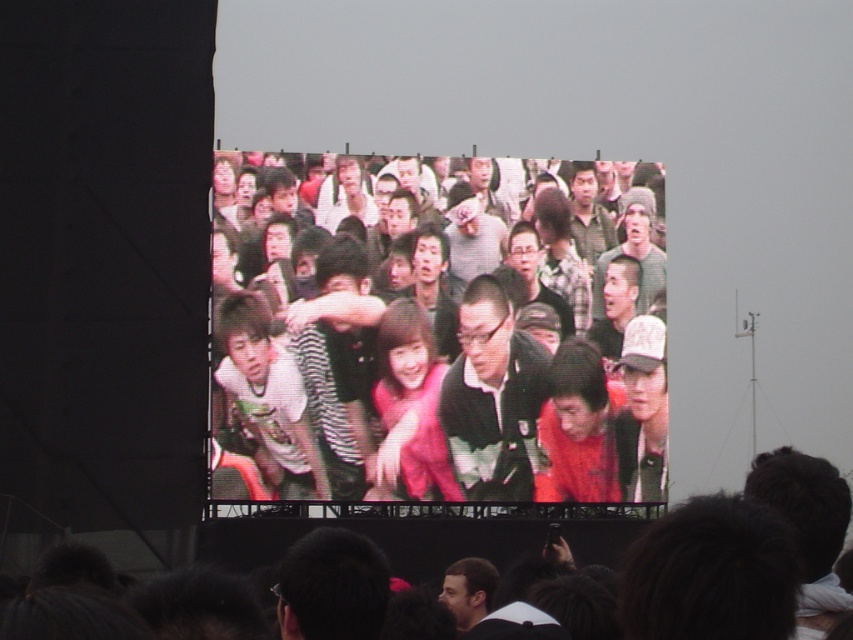
You are a photographer at the event and want to capture a photo that includes both the matte black jacket at center and the pink fabric crowd at center. Which object should you focus on first to ensure both are in the frame?

The pink fabric crowd at center is behind matte black jacket at center, so you should focus on the matte black jacket at center first to ensure both are in the frame.

You are standing in the crowd at the outdoor event and want to find the person wearing the matte black jacket at center. According to the coordinates given, where should you look relative to your current position?

The matte black jacket at center is located at the coordinates point (457, 346), which is slightly to the right and just below the center of the frame. To find it, look slightly to your right and a bit downward from the center point.

You are standing at the camera position and want to throw a paper airplane to the matte black jacket at center. Considering the distance, is it feasible?

The distance between the matte black jacket at center and the camera is 142.29 meters. Throwing a paper airplane that far is not feasible as typical paper airplanes have a maximum range of around 30 meters.